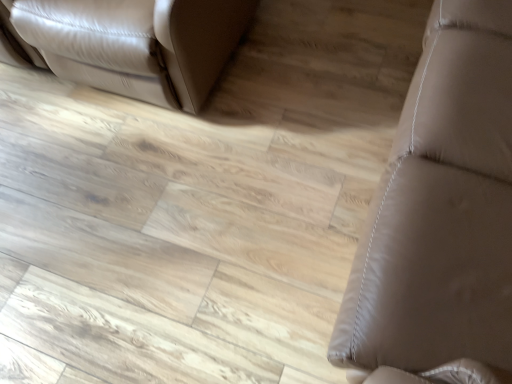
This screenshot has width=512, height=384. I want to click on unoccupied area in front of matte leather couch at upper left, the first furniture in the left-to-right sequence, so click(176, 210).